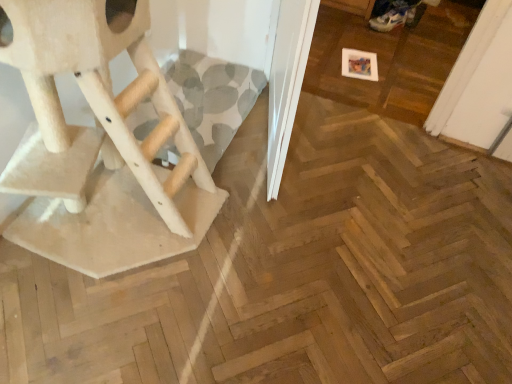
Find the location of a particular element. vacant space underneath beige carpeted cat tree at left (from a real-world perspective) is located at coordinates (122, 226).